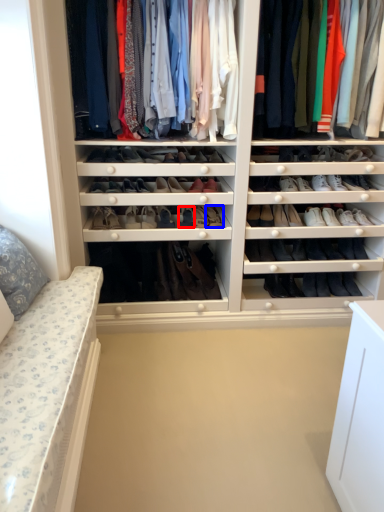
Question: Which point is further to the camera, shoe (highlighted by a red box) or shoe (highlighted by a blue box)?

Choices:
 (A) shoe
 (B) shoe

Answer: (B)